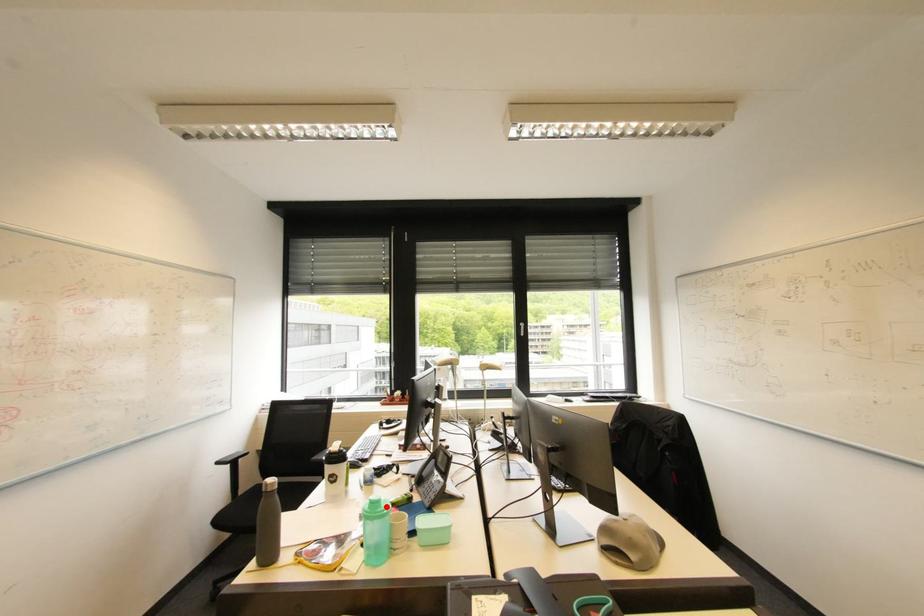
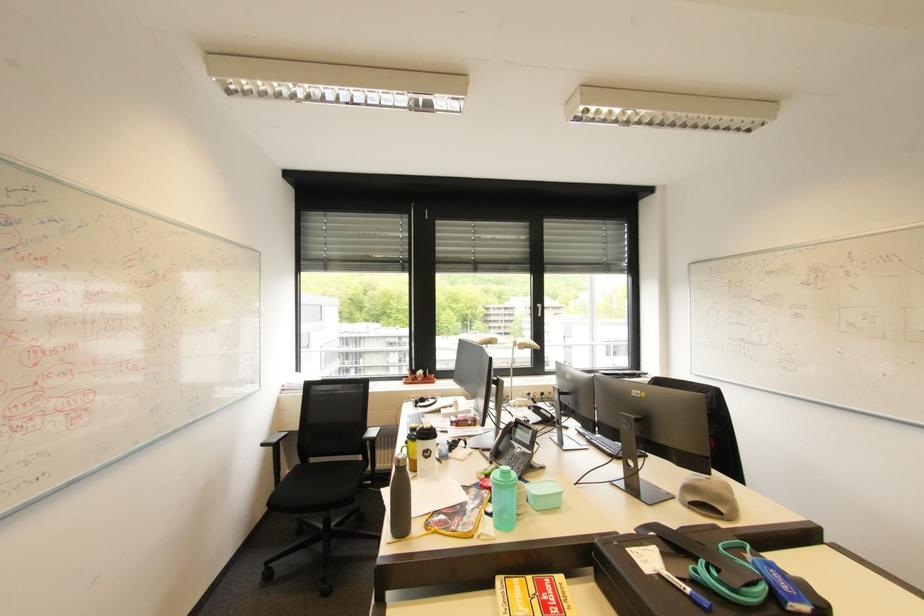
In the second image, find the point that corresponds to the highlighted location in the first image.

(517, 477)